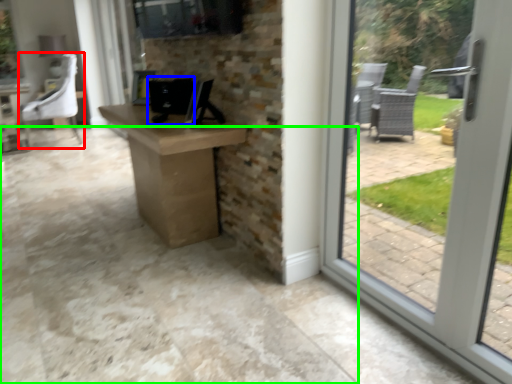
Question: Which is farther away from chair (highlighted by a red box)? desktop computer (highlighted by a blue box) or concrete (highlighted by a green box)?

Choices:
 (A) desktop computer
 (B) concrete

Answer: (A)